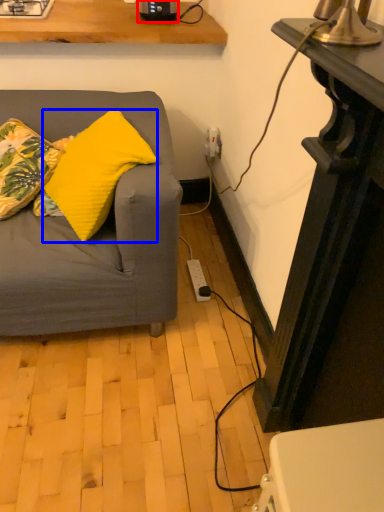
Question: Which point is further to the camera, appliance (highlighted by a red box) or pillow (highlighted by a blue box)?

Choices:
 (A) appliance
 (B) pillow

Answer: (A)